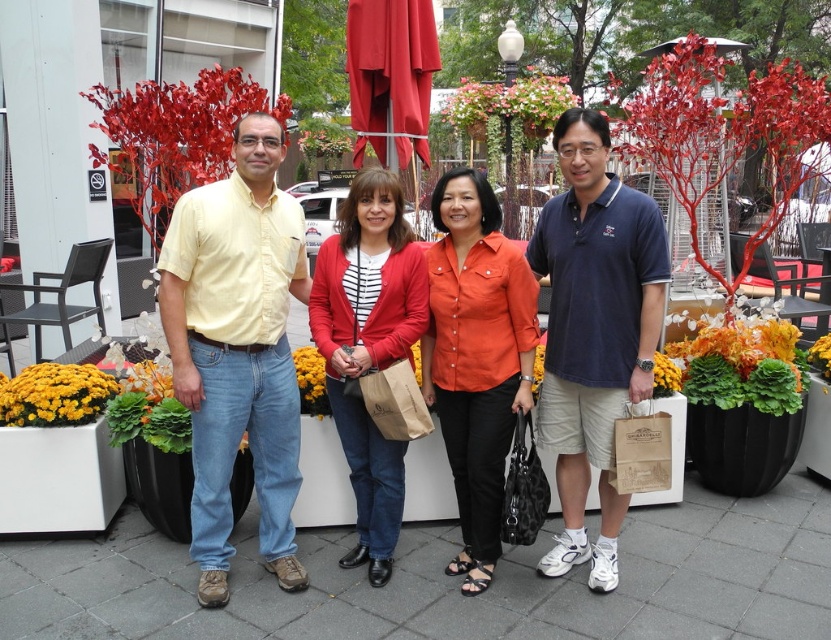
Question: Which of the following is the farthest from the observer?

Choices:
 (A) (541, 337)
 (B) (549, 356)
 (C) (428, 369)

Answer: (A)

Question: Observing the image, what is the correct spatial positioning of matte red blazer at center in reference to green leafy plant at center?

Choices:
 (A) above
 (B) below

Answer: (B)

Question: Is matte yellow shirt at center further to the viewer compared to yellow matte flowers at lower left?

Choices:
 (A) yes
 (B) no

Answer: (B)

Question: Which of the following is the farthest from the observer?

Choices:
 (A) orange cotton shirt at center
 (B) yellow fabric flower at center

Answer: (B)

Question: Does yellow cotton shirt at left appear over green leafy plant at center?

Choices:
 (A) no
 (B) yes

Answer: (B)

Question: Among these points, which one is nearest to the camera?

Choices:
 (A) (603, 502)
 (B) (539, 369)
 (C) (441, 412)

Answer: (C)